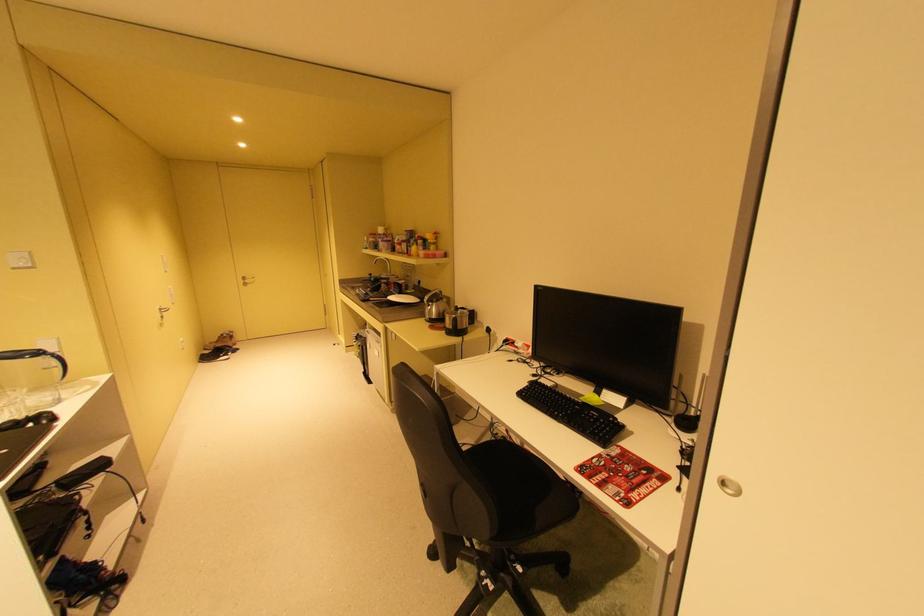
Find where to lift the black kettle handle. Please return your answer as a coordinate pair (x, y).

(61, 363)